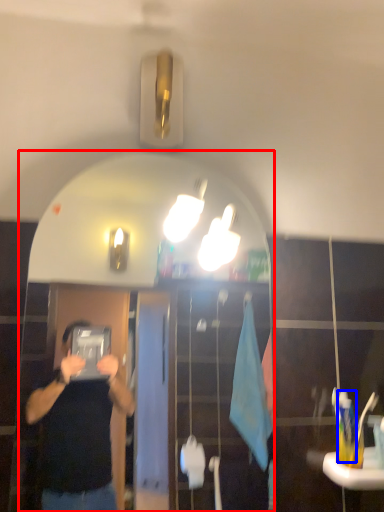
Question: Which of the following is the closest to the observer, mirror (highlighted by a red box) or toothbrush (highlighted by a blue box)?

Choices:
 (A) mirror
 (B) toothbrush

Answer: (A)